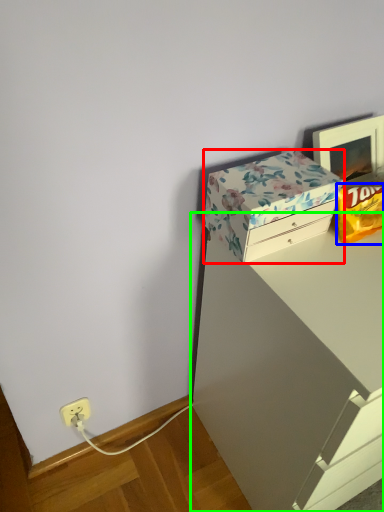
Question: Which object is positioned closest to box (highlighted by a red box)? Select from wrapping paper (highlighted by a blue box) and vanity (highlighted by a green box).

Choices:
 (A) wrapping paper
 (B) vanity

Answer: (A)